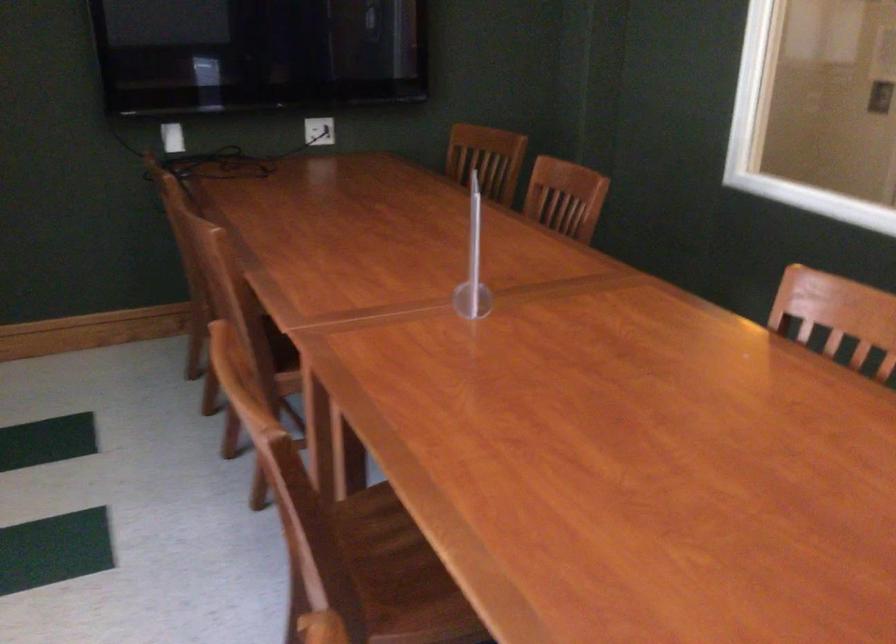
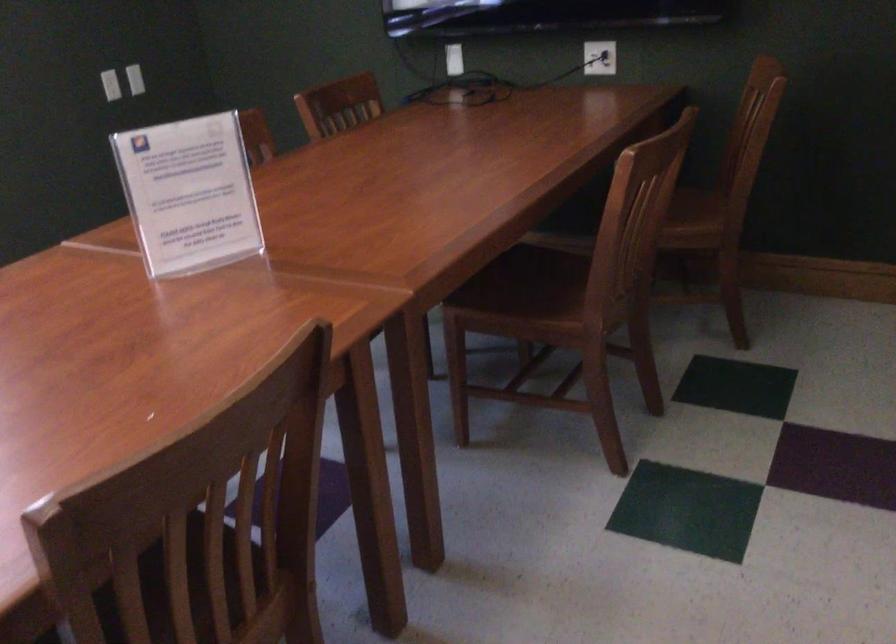
The point at (334, 127) is marked in the first image. Where is the corresponding point in the second image?

(599, 58)